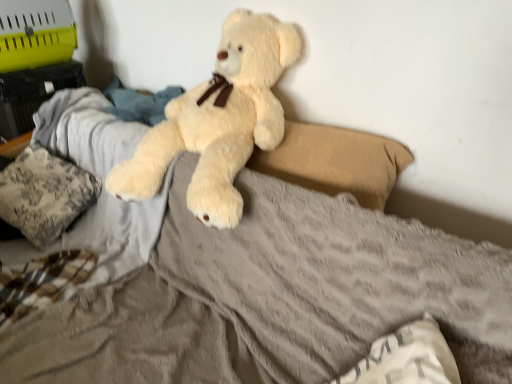
Question: From a real-world perspective, does white soft pillow at lower right, which is the 1th pillow in right-to-left order, sit lower than beige fabric pillow at center, the second pillow in the front-to-back sequence?

Choices:
 (A) yes
 (B) no

Answer: (A)

Question: Can you confirm if white soft pillow at lower right, which is the 1th pillow in right-to-left order, is wider than beige fabric pillow at center, the second pillow in the front-to-back sequence?

Choices:
 (A) yes
 (B) no

Answer: (A)

Question: Is white soft pillow at lower right, arranged as the 3th pillow when viewed from the left, oriented towards beige fabric pillow at center, the 2th pillow in the left-to-right sequence?

Choices:
 (A) no
 (B) yes

Answer: (A)

Question: From the image's perspective, would you say white soft pillow at lower right, arranged as the 3th pillow when viewed from the left, is shown under beige fabric pillow at center, the second pillow when ordered from back to front?

Choices:
 (A) yes
 (B) no

Answer: (A)

Question: Is white soft pillow at lower right, which is the 1th pillow from front to back, in front of beige fabric pillow at center, the second pillow in the front-to-back sequence?

Choices:
 (A) no
 (B) yes

Answer: (B)

Question: In terms of height, does beige fabric pillow at center, the second pillow in the front-to-back sequence, look taller or shorter compared to white soft pillow at lower right, arranged as the 3th pillow when viewed from the left?

Choices:
 (A) short
 (B) tall

Answer: (B)

Question: Is beige fabric pillow at center, which appears as the second pillow when viewed from the right, in front of or behind white soft pillow at lower right, which is the 1th pillow in right-to-left order, in the image?

Choices:
 (A) front
 (B) behind

Answer: (B)

Question: In terms of width, does beige fabric pillow at center, the 2th pillow in the left-to-right sequence, look wider or thinner when compared to white soft pillow at lower right, which is the 1th pillow in right-to-left order?

Choices:
 (A) thin
 (B) wide

Answer: (A)

Question: In terms of size, does beige fabric pillow at center, the second pillow when ordered from back to front, appear bigger or smaller than white soft pillow at lower right, the 3th pillow when ordered from back to front?

Choices:
 (A) small
 (B) big

Answer: (B)

Question: From the image's perspective, is white soft pillow at lower right, which is the 1th pillow from front to back, positioned above or below fluffy beige teddy bear at center?

Choices:
 (A) below
 (B) above

Answer: (A)

Question: From a real-world perspective, is white soft pillow at lower right, which is the 1th pillow in right-to-left order, above or below fluffy beige teddy bear at center?

Choices:
 (A) above
 (B) below

Answer: (B)

Question: Based on their positions, is white soft pillow at lower right, the 3th pillow when ordered from back to front, located to the left or right of fluffy beige teddy bear at center?

Choices:
 (A) left
 (B) right

Answer: (B)

Question: Is white soft pillow at lower right, which is the 1th pillow in right-to-left order, in front of or behind fluffy beige teddy bear at center in the image?

Choices:
 (A) behind
 (B) front

Answer: (B)

Question: Is point (394, 337) positioned closer to the camera than point (8, 178)?

Choices:
 (A) closer
 (B) farther

Answer: (A)

Question: Based on their sizes in the image, would you say white soft pillow at lower right, which is the 1th pillow in right-to-left order, is bigger or smaller than fluffy fabric pillow at left, which ranks as the first pillow in left-to-right order?

Choices:
 (A) small
 (B) big

Answer: (A)